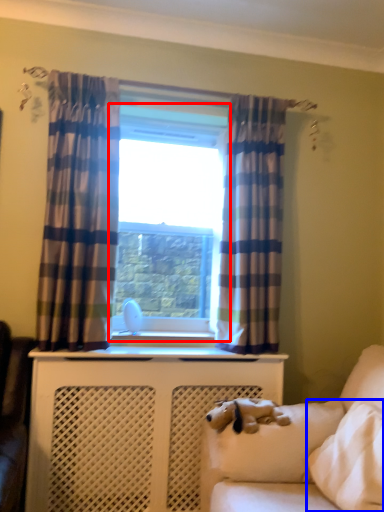
Question: Which of the following is the farthest to the observer, window (highlighted by a red box) or pillow (highlighted by a blue box)?

Choices:
 (A) window
 (B) pillow

Answer: (A)